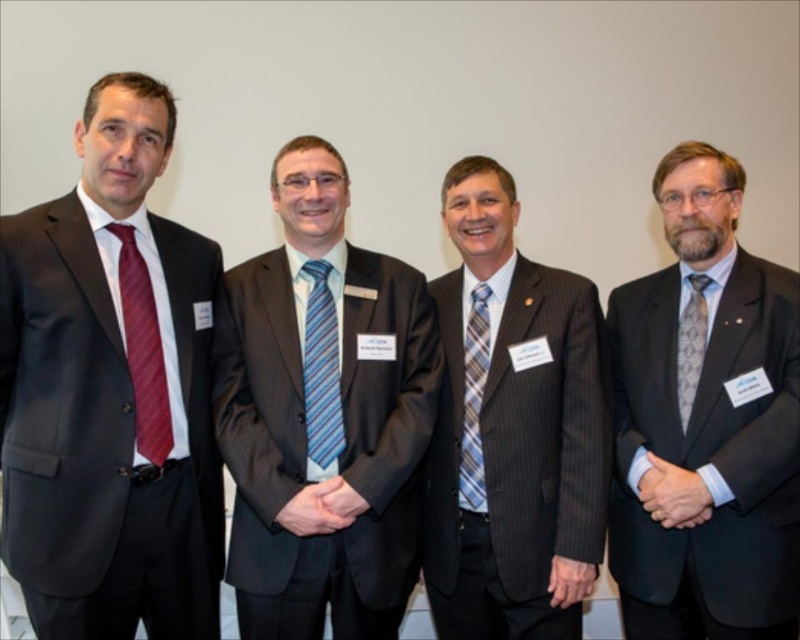
You are standing in front of the image and want to locate the matte red tie at left. Where is it positioned in terms of coordinates?

The matte red tie at left is positioned at coordinates point (142, 349).

In the scene shown: You are taking a photo of the four men in the scene. You want to focus on the point closer to the camera between the two points labeled as point (x=140, y=406) and point (x=308, y=356). Which point should you focus on?

You should focus on point (x=140, y=406) because it is closer to the camera than point (x=308, y=356).